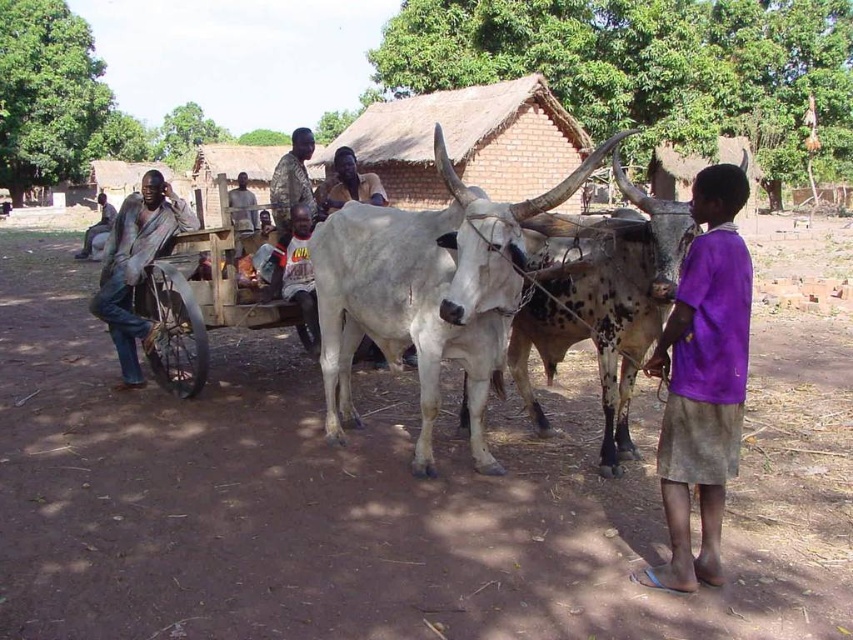
You are standing at the center of the image. Which direction should you move to reach the blue jeans at left?

The blue jeans at left is located at point (136, 266), so you should move to the left to reach it.